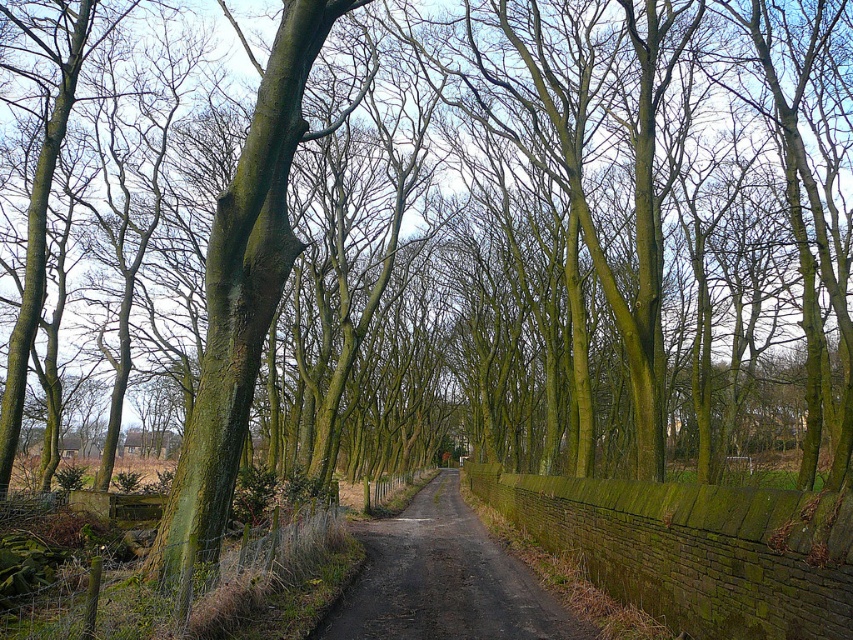
Which of these two, green mossy wire at lower left or dark brown asphalt at center, stands shorter?

green mossy wire at lower left

Can you confirm if green mossy wire at lower left is thinner than dark brown asphalt at center?

Indeed, green mossy wire at lower left has a lesser width compared to dark brown asphalt at center.

Does point (314, 605) come in front of point (476, 572)?

Yes, point (314, 605) is closer to viewer.

This screenshot has width=853, height=640. Identify the location of green mossy wire at lower left. (198, 588).